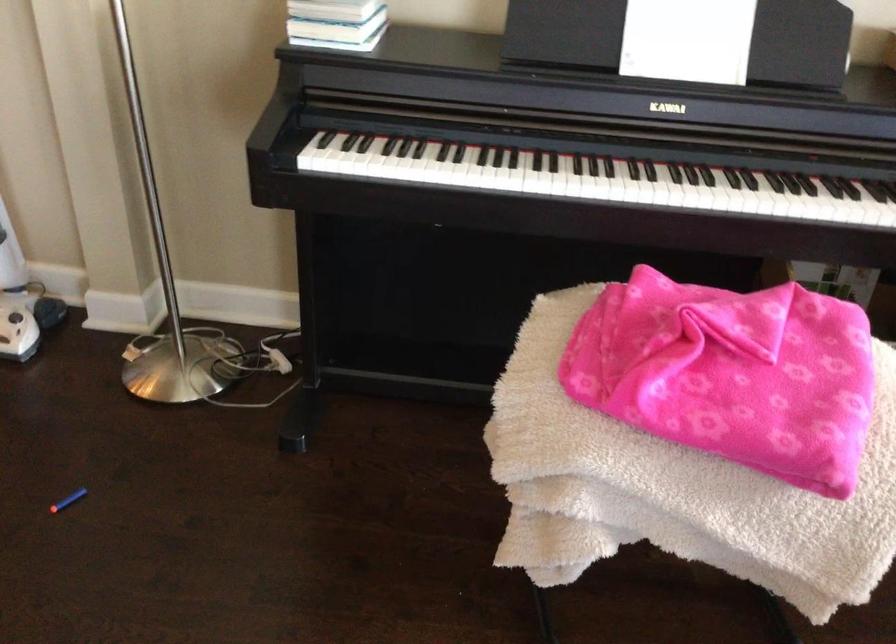
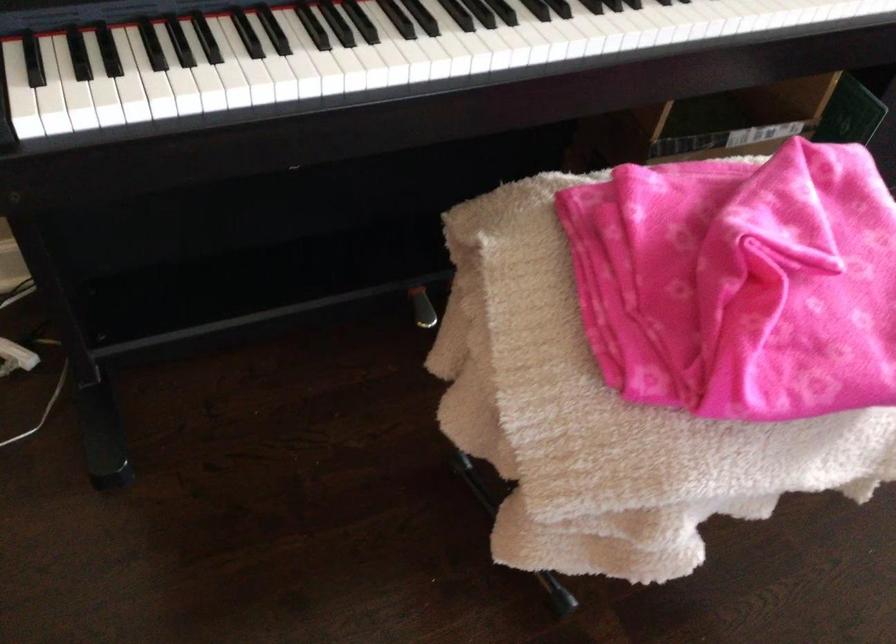
In the second image, find the point that corresponds to point (532, 399) in the first image.

(571, 406)